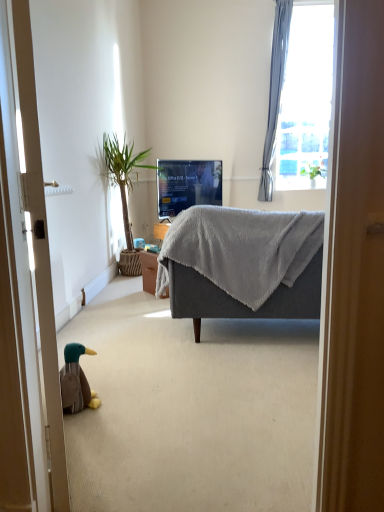
What are the coordinates of `free point to the right of wooden door at left` in the screenshot? It's located at (167, 441).